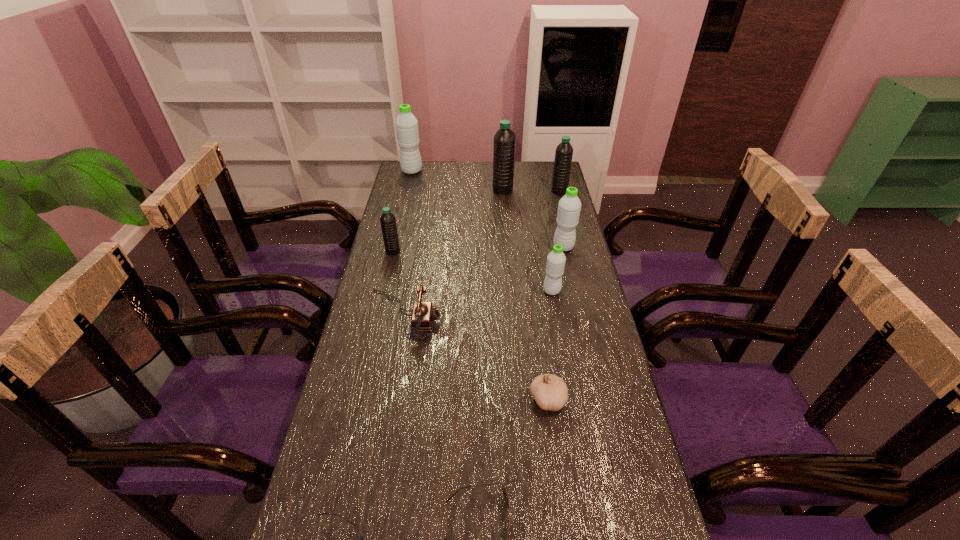
You are a GUI agent. You are given a task and a screenshot of the screen. Output one action in this format:
    pyautogui.click(x=<x>, y=<y>)
    Task: Click on the biggest green water bottle
    The height and width of the screenshot is (540, 960).
    Given the screenshot: What is the action you would take?
    pyautogui.click(x=406, y=123)

Locate an element on the screen. Image resolution: width=960 pixels, height=540 pixels. the farthest green water bottle is located at coordinates (406, 123).

Identify the location of the fourth water bottle from right to left. (504, 140).

Locate an element on the screen. the biggest black water bottle is located at coordinates (504, 140).

Locate an element on the screen. the second biggest black water bottle is located at coordinates (564, 151).

In order to click on the second nearest green water bottle in this screenshot , I will do `click(569, 206)`.

This screenshot has width=960, height=540. I want to click on the rightmost green water bottle, so click(569, 206).

This screenshot has height=540, width=960. I want to click on the nearest black water bottle, so click(x=387, y=220).

Where is `the smallest black water bottle`? This screenshot has height=540, width=960. the smallest black water bottle is located at coordinates (387, 220).

Find the location of a particular element. the third water bottle from right to left is located at coordinates (555, 265).